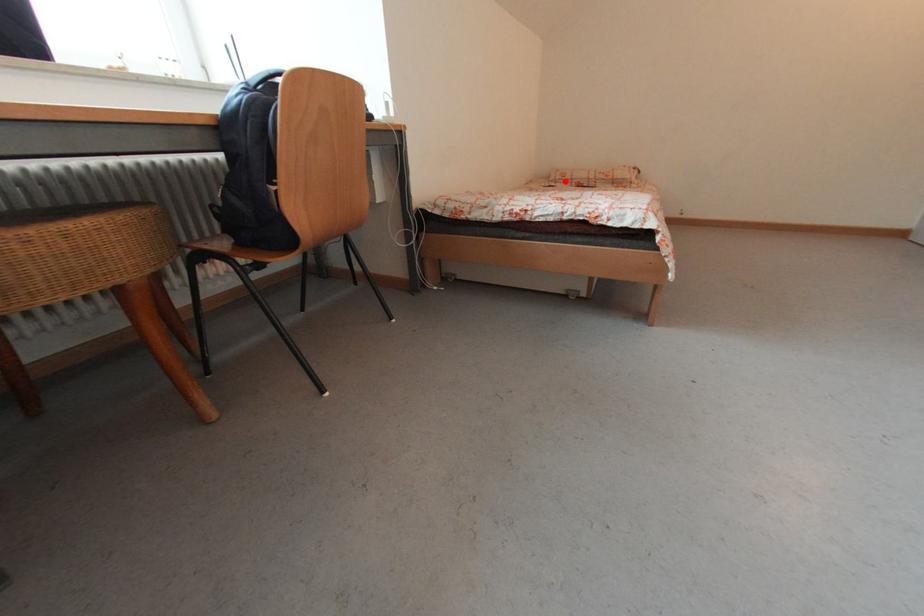
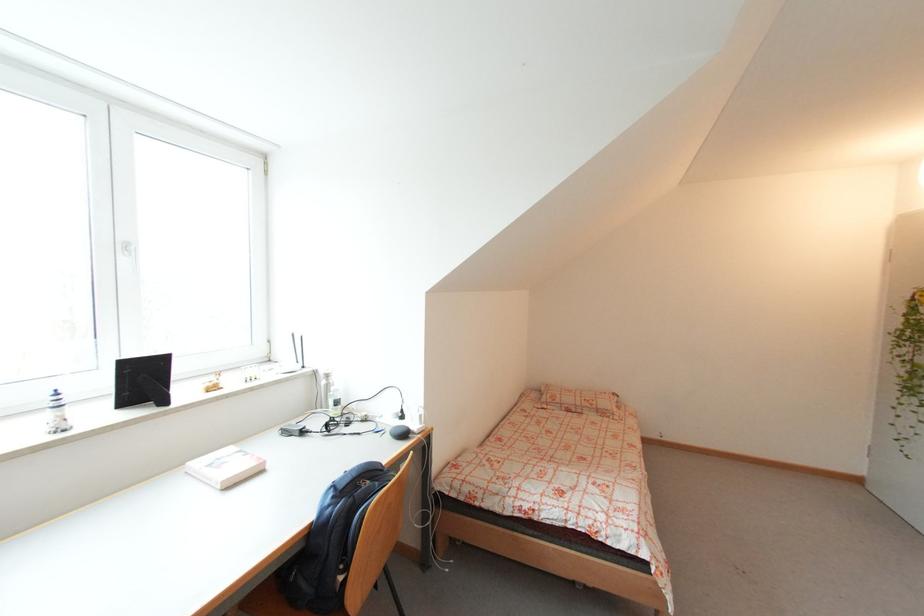
Question: A red point is marked in image1. In image2, is the corresponding 3D point closer to the camera or farther? Reply with the corresponding letter.

Choices:
 (A) The corresponding 3D point is closer.
 (B) The corresponding 3D point is farther.

Answer: (A)